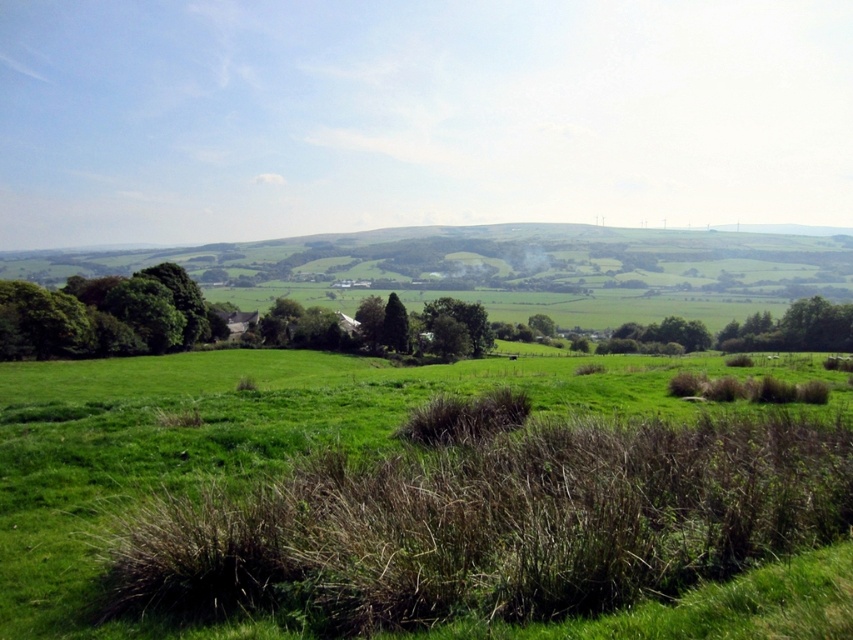
Question: Is green leafy tree at left positioned behind green leafy tree at lower right?

Choices:
 (A) no
 (B) yes

Answer: (A)

Question: Can you confirm if green grassy field at center is thinner than green leafy tree at left?

Choices:
 (A) no
 (B) yes

Answer: (A)

Question: Which object appears farthest from the camera in this image?

Choices:
 (A) green leafy tree at center
 (B) green leafy tree at lower right

Answer: (A)

Question: Which of the following is the closest to the observer?

Choices:
 (A) green leafy tree at left
 (B) green leafy tree at lower right

Answer: (A)

Question: Is green leafy tree at left to the left of green leafy tree at lower right from the viewer's perspective?

Choices:
 (A) no
 (B) yes

Answer: (B)

Question: Among these objects, which one is nearest to the camera?

Choices:
 (A) green grassy field at center
 (B) green leafy tree at left
 (C) green leafy tree at center

Answer: (A)